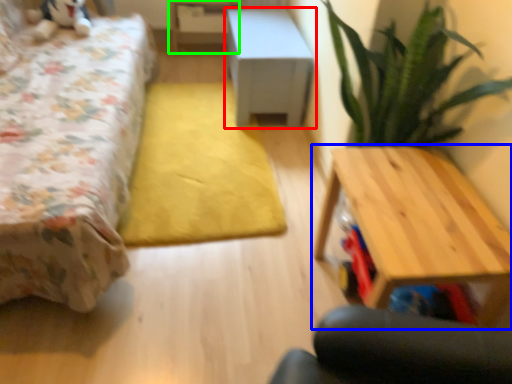
Question: Considering the real-world distances, which object is farthest from table (highlighted by a red box)? table (highlighted by a blue box) or table (highlighted by a green box)?

Choices:
 (A) table
 (B) table

Answer: (A)